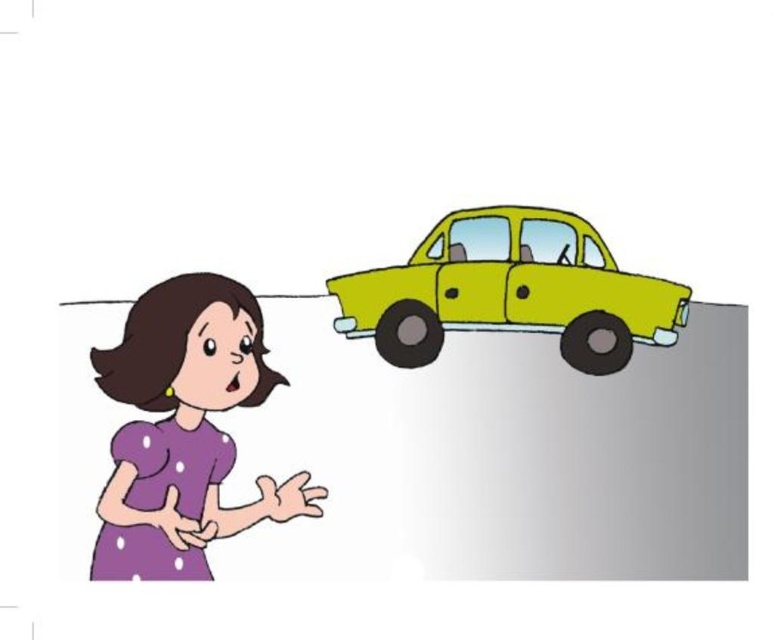
You are a photographer trying to capture a photo of the purple dotted dress at lower left and the yellow matte car at upper right in the scene. The camera can only focus on objects within 10 inches of each other. Will both objects be in focus?

The purple dotted dress at lower left and yellow matte car at upper right are 9.93 inches apart, which is within the camera focus range of 10 inches. Therefore, both objects will be in focus.

You are a pedestrian standing near the purple dotted dress at lower left and the yellow matte car at upper right. Which object is closer to the ground?

The purple dotted dress at lower left is positioned under the yellow matte car at upper right, so the purple dotted dress at lower left is closer to the ground.

You are standing at the origin point of the coordinate system. You see the purple dotted dress at lower left represented by point [183,429]. Can you determine if the purple dotted dress at lower left is closer to the x or y axis?

The coordinates of the purple dotted dress at lower left are 0.673 on the x and 0.238 on the y. Since 0.673 is greater than 0.238, the purple dotted dress at lower left is closer to the y axis.